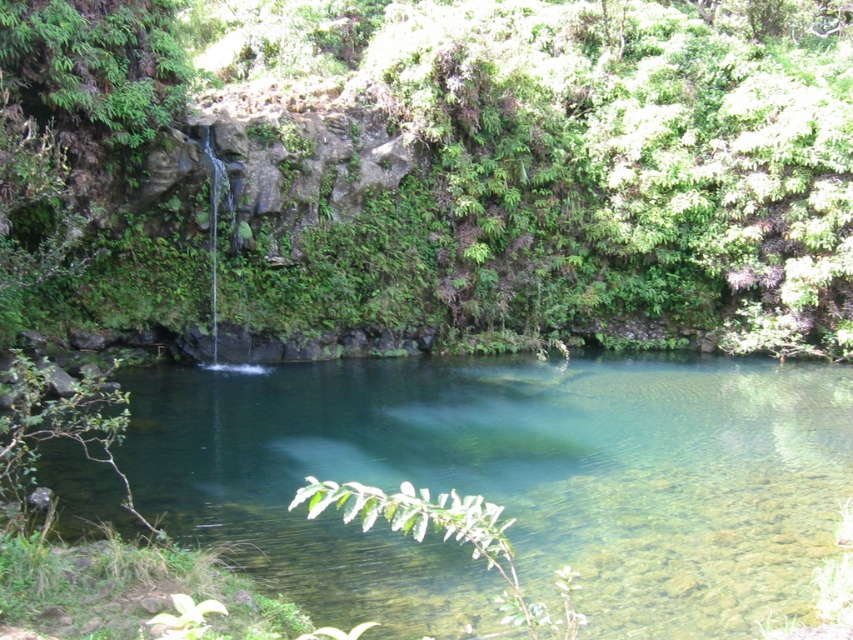
Question: Is green leafy vegetation at upper center bigger than clear glass lake at center?

Choices:
 (A) no
 (B) yes

Answer: (B)

Question: Which of the following is the closest to the observer?

Choices:
 (A) (759, 435)
 (B) (752, 252)

Answer: (A)

Question: Is green leafy vegetation at upper center further to camera compared to clear glass lake at center?

Choices:
 (A) no
 (B) yes

Answer: (B)

Question: Which point appears farthest from the camera in this image?

Choices:
 (A) (618, 115)
 (B) (259, 428)

Answer: (A)

Question: Among these objects, which one is nearest to the camera?

Choices:
 (A) green leafy vegetation at upper center
 (B) clear glass lake at center

Answer: (B)

Question: Is green leafy vegetation at upper center thinner than clear glass lake at center?

Choices:
 (A) yes
 (B) no

Answer: (B)